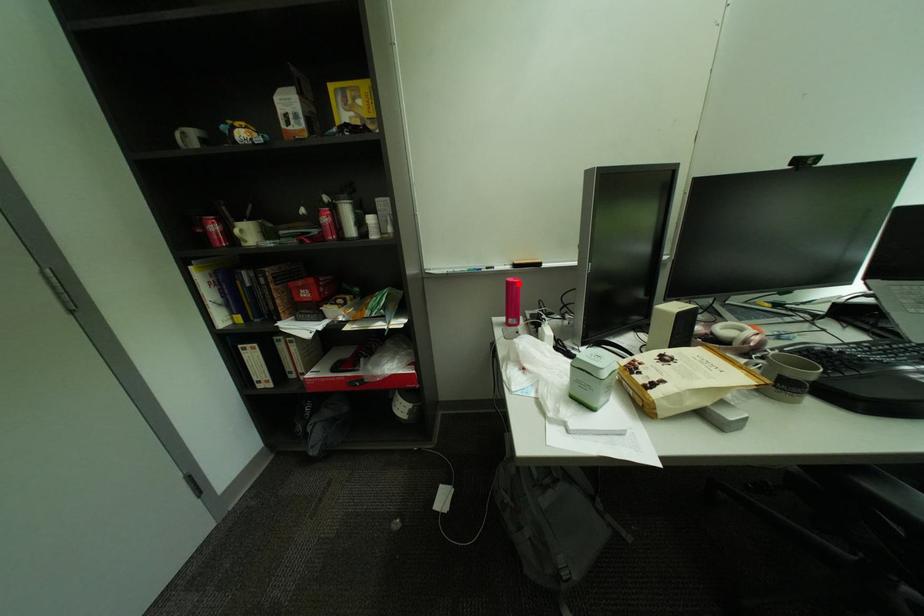
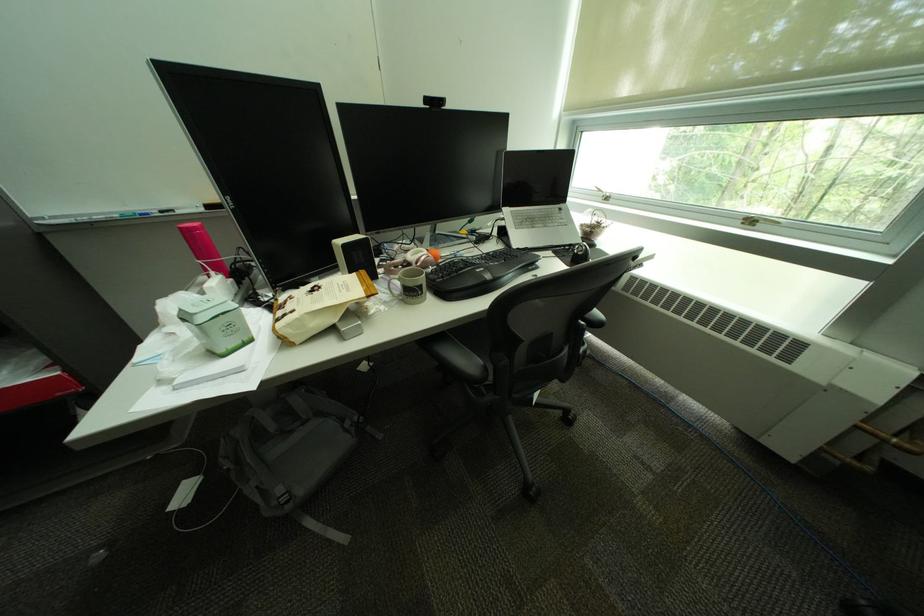
Find the pixel in the second image that matches the highlighted location in the first image.

(190, 230)